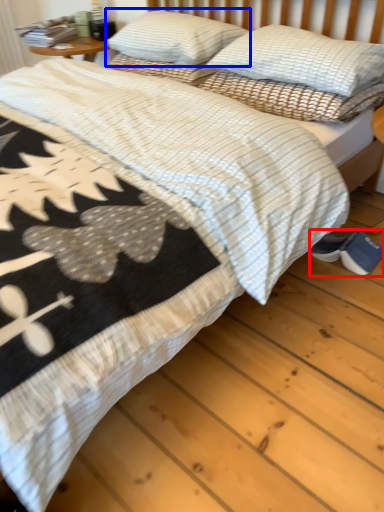
Question: Which of the following is the farthest to the observer, footwear (highlighted by a red box) or pillow (highlighted by a blue box)?

Choices:
 (A) footwear
 (B) pillow

Answer: (B)